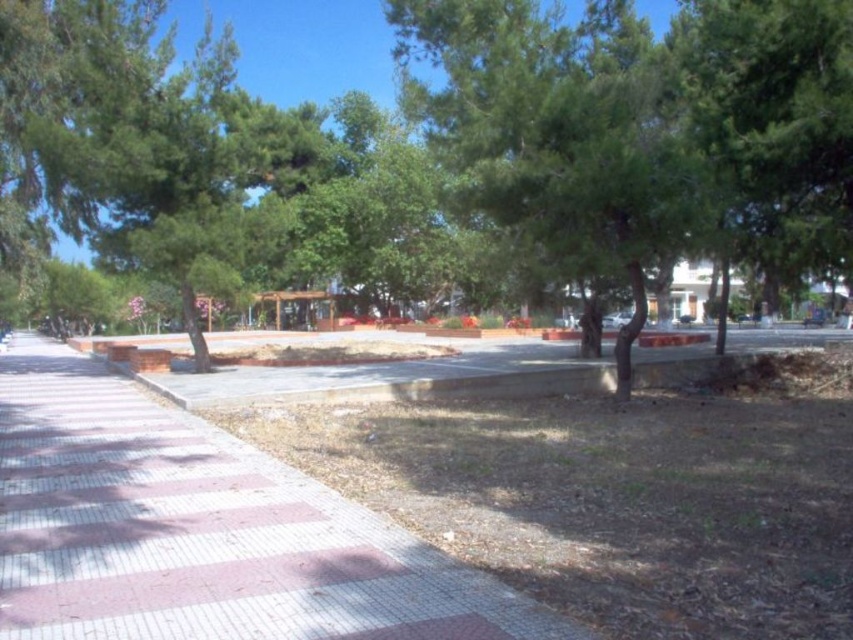
Is green leafy tree at center below green leafy tree at left?

Incorrect, green leafy tree at center is not positioned below green leafy tree at left.

Does green leafy tree at center appear over green leafy tree at left?

Yes, green leafy tree at center is above green leafy tree at left.

Where is `green leafy tree at center`? The image size is (853, 640). green leafy tree at center is located at coordinates (439, 150).

Who is positioned more to the right, green leafy tree at center or red brick pavement at left?

From the viewer's perspective, green leafy tree at center appears more on the right side.

Is green leafy tree at center to the right of red brick pavement at left from the viewer's perspective?

Yes, green leafy tree at center is to the right of red brick pavement at left.

Between point (665, 148) and point (177, 545), which one is positioned in front?

Positioned in front is point (177, 545).

Image resolution: width=853 pixels, height=640 pixels. What are the coordinates of `green leafy tree at center` in the screenshot? It's located at [x=439, y=150].

Does point (107, 410) lie in front of point (125, 184)?

Yes.

This screenshot has width=853, height=640. Describe the element at coordinates (202, 531) in the screenshot. I see `red brick pavement at left` at that location.

Find the location of a particular element. This screenshot has width=853, height=640. red brick pavement at left is located at coordinates click(202, 531).